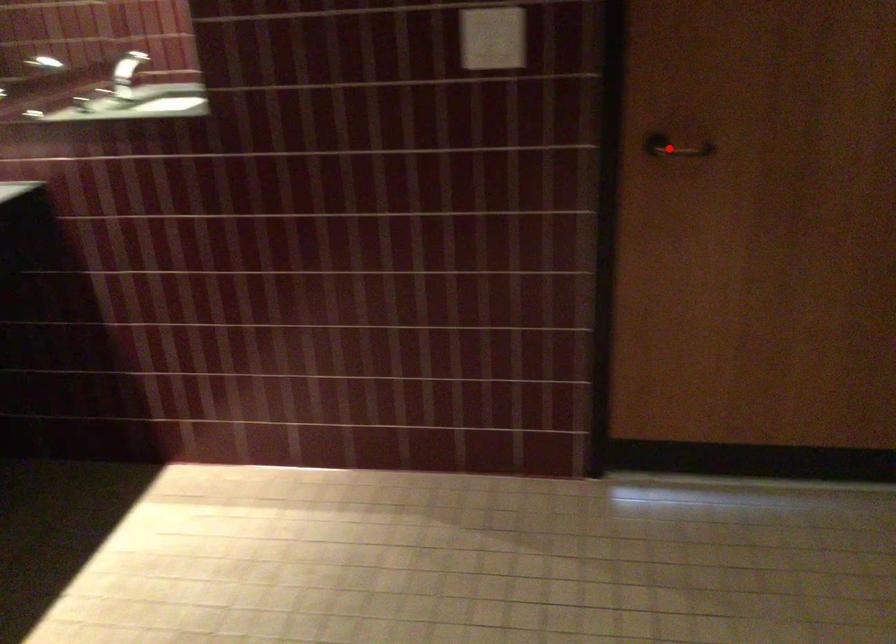
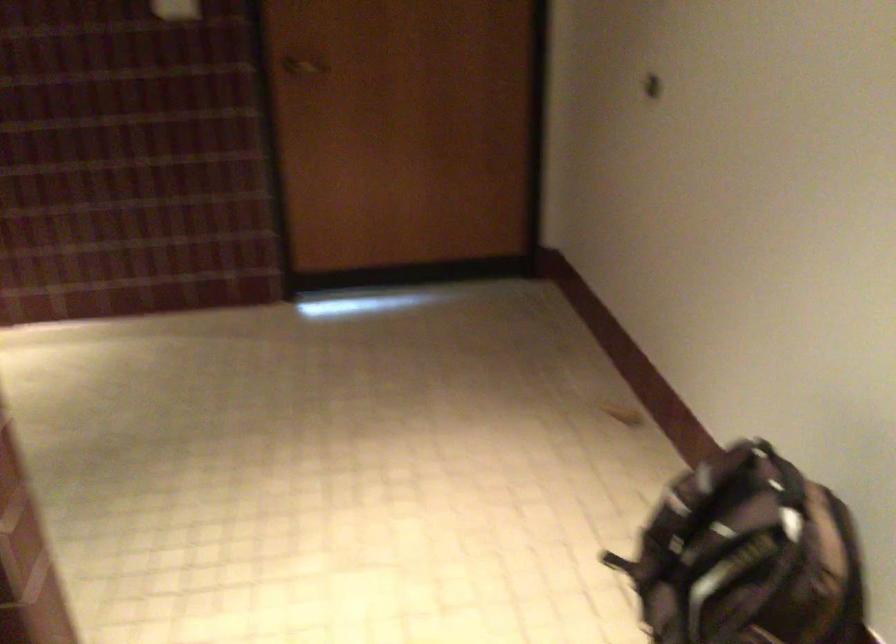
Question: I am providing you with two images of the same scene from different viewpoints. In image1, a red point is highlighted. Considering the same 3D point in image2, which of the following is correct?

Choices:
 (A) It is closer
 (B) It is farther

Answer: (B)